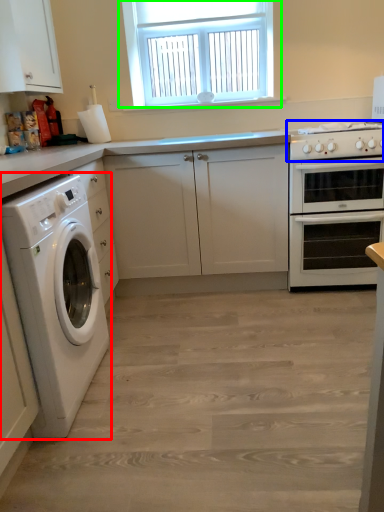
Question: Considering the real-world distances, which object is farthest from washing machine (highlighted by a red box)? gas stove (highlighted by a blue box) or window (highlighted by a green box)?

Choices:
 (A) gas stove
 (B) window

Answer: (B)